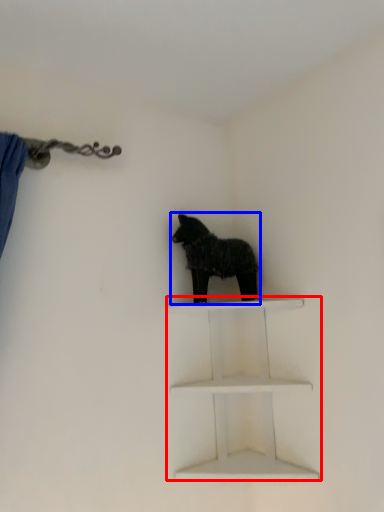
Question: Which of the following is the farthest to the observer, shelf (highlighted by a red box) or dog (highlighted by a blue box)?

Choices:
 (A) shelf
 (B) dog

Answer: (B)